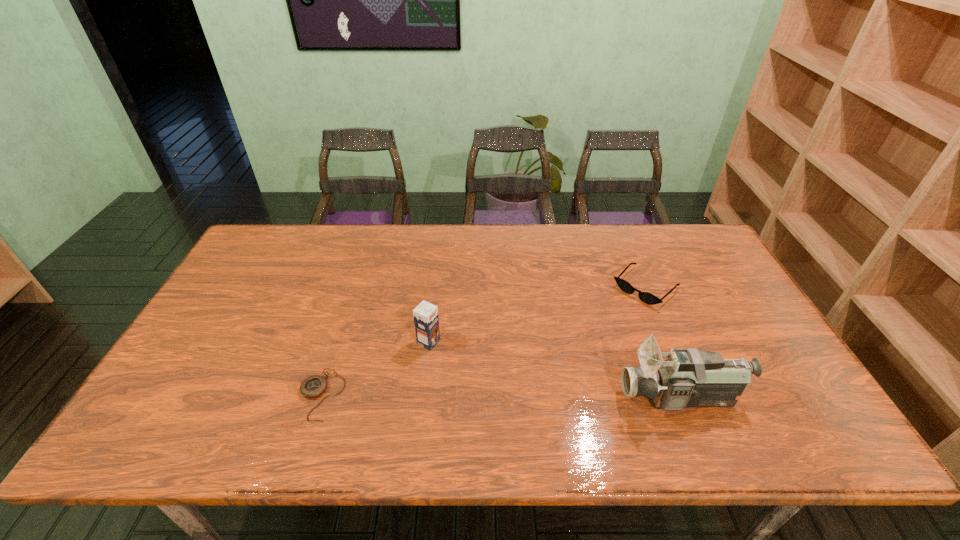
Find the location of `object that is at the right edge`. object that is at the right edge is located at coordinates tap(690, 377).

At what (x,y) coordinates should I click in order to perform the action: click on object present at the near right corner. Please return your answer as a coordinate pair (x, y). This screenshot has width=960, height=540. Looking at the image, I should click on (690, 377).

Identify the location of vacant space at the far edge. (462, 254).

Find the location of `free space at the near edge of the desktop`. free space at the near edge of the desktop is located at coordinates (550, 391).

Where is `vacant space at the left edge`? vacant space at the left edge is located at coordinates (266, 277).

You are a GUI agent. You are given a task and a screenshot of the screen. Output one action in this format:
    pyautogui.click(x=<x>, y=<y>)
    Task: Click on the vacant region at the right edge of the desktop
    The width and height of the screenshot is (960, 540).
    Given the screenshot: What is the action you would take?
    pyautogui.click(x=708, y=320)

This screenshot has width=960, height=540. In the image, there is a desktop. In order to click on vacant area at the far left corner in this screenshot , I will do `click(264, 261)`.

This screenshot has height=540, width=960. What are the coordinates of `free space between the camcorder and the third nearest object` in the screenshot? It's located at (555, 370).

Locate an element on the screen. The height and width of the screenshot is (540, 960). vacant area that lies between the tallest object and the second shortest object is located at coordinates (663, 342).

This screenshot has height=540, width=960. What are the coordinates of `vacant area that lies between the third tallest object and the chocolate milk` in the screenshot? It's located at (538, 315).